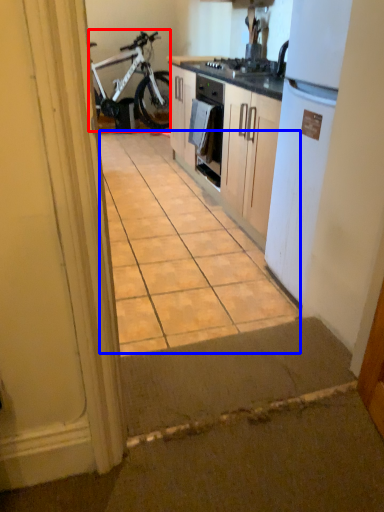
Question: Which point is closer to the camera, bicycle (highlighted by a red box) or ceramic tile (highlighted by a blue box)?

Choices:
 (A) bicycle
 (B) ceramic tile

Answer: (B)